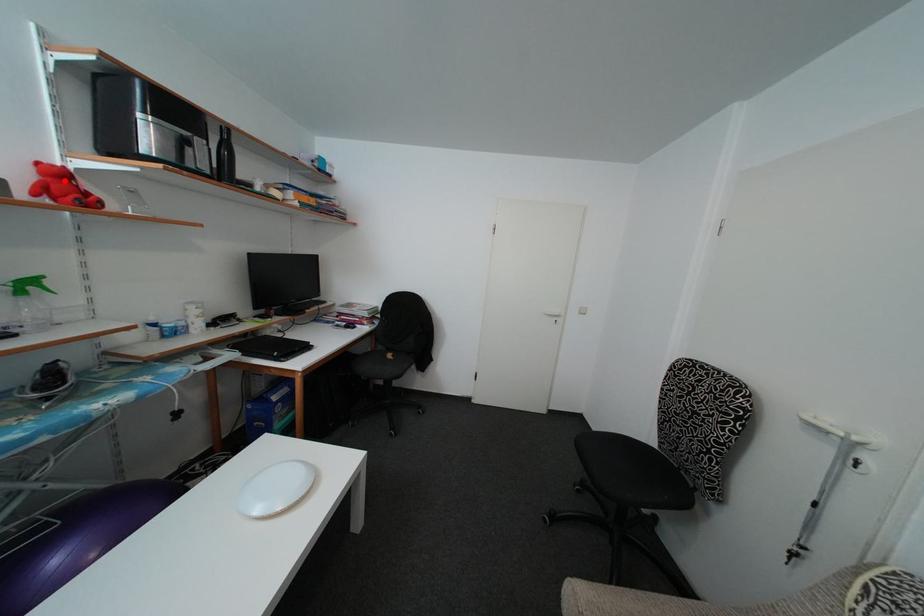
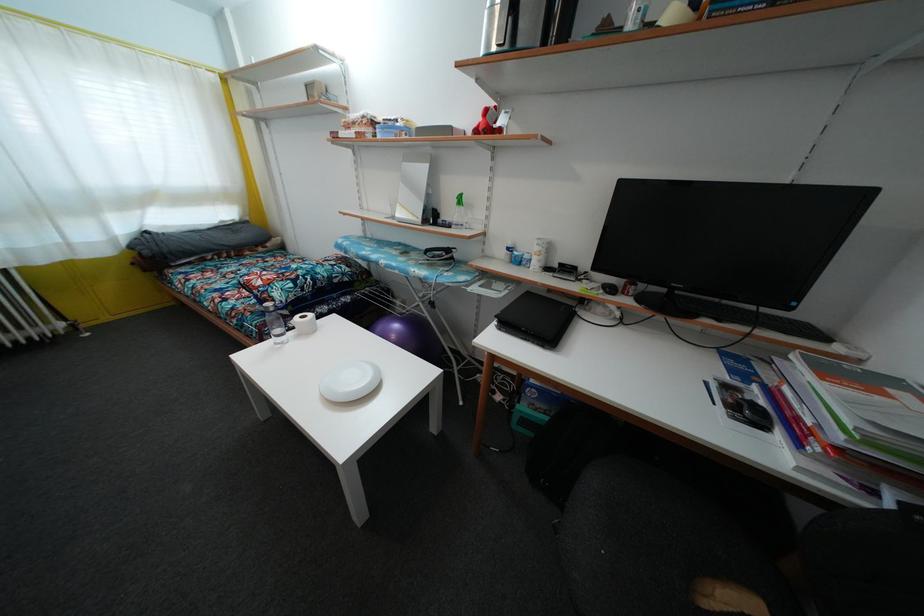
Question: I am providing you with two images of the same scene from different viewpoints. In image1, a red point is highlighted. Considering the same 3D point in image2, which of the following is correct?

Choices:
 (A) It is closer
 (B) It is farther

Answer: (A)